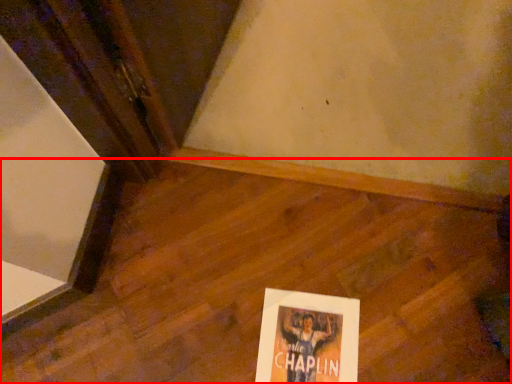
Question: From the image, what is the correct spatial relationship of plywood (annotated by the red box) in relation to poster?

Choices:
 (A) left
 (B) right

Answer: (A)